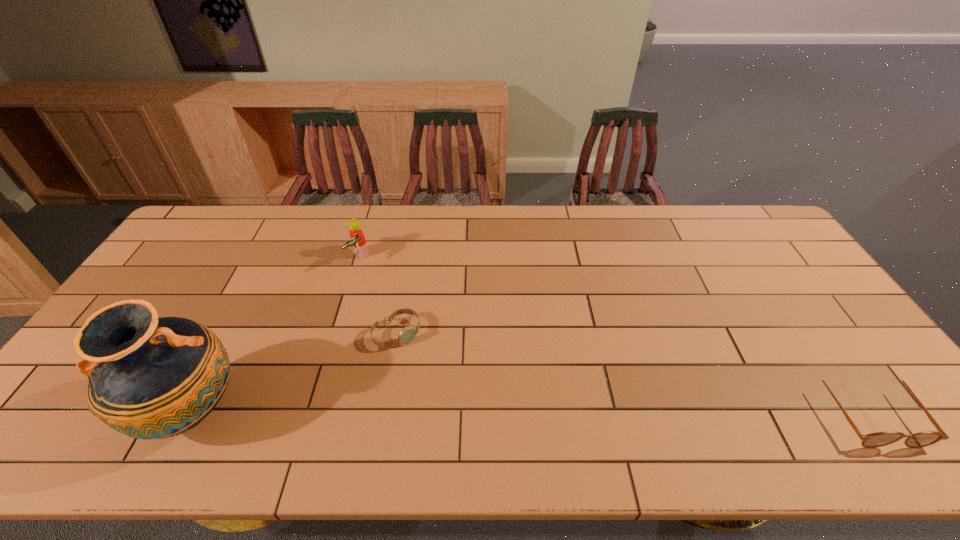
Where is `free space at the near edge of the desktop`? free space at the near edge of the desktop is located at coordinates (799, 392).

This screenshot has width=960, height=540. In the image, there is a desktop. What are the coordinates of `vacant space at the right edge` in the screenshot? It's located at (879, 379).

At what (x,y) coordinates should I click in order to perform the action: click on vacant space at the near right corner of the desktop. Please return your answer as a coordinate pair (x, y). The height and width of the screenshot is (540, 960). Looking at the image, I should click on (855, 415).

Locate an element on the screen. This screenshot has width=960, height=540. vacant area that lies between the third object from left to right and the sunglasses is located at coordinates (631, 371).

Locate an element on the screen. The image size is (960, 540). free space between the tallest object and the farthest object is located at coordinates (276, 334).

Find the location of `free space between the second object from right to left and the rightmost object`. free space between the second object from right to left and the rightmost object is located at coordinates (631, 371).

You are a GUI agent. You are given a task and a screenshot of the screen. Output one action in this format:
    pyautogui.click(x=<x>, y=<y>)
    Task: Click on the vacant area between the farthest object and the leftmost object
    
    Given the screenshot: What is the action you would take?
    pyautogui.click(x=276, y=334)

Find the location of `free spot between the watch and the third shortest object`. free spot between the watch and the third shortest object is located at coordinates (378, 295).

The image size is (960, 540). I want to click on unoccupied position between the Lego and the third object from left to right, so click(378, 295).

You are a GUI agent. You are given a task and a screenshot of the screen. Output one action in this format:
    pyautogui.click(x=<x>, y=<y>)
    Task: Click on the free area in between the Lego and the third nearest object
    
    Given the screenshot: What is the action you would take?
    pyautogui.click(x=378, y=295)